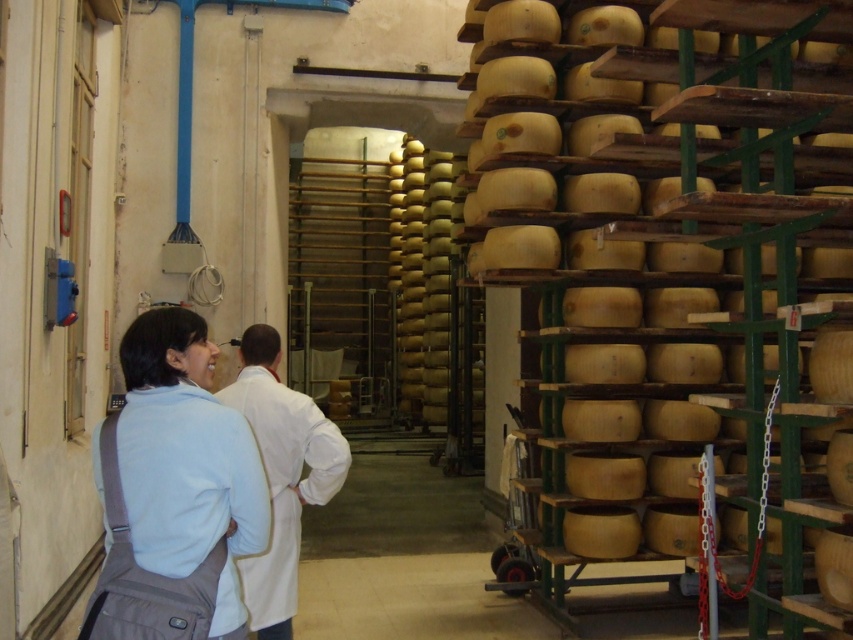
Question: Which point is farther to the camera?

Choices:
 (A) white lab coat at center
 (B) wooden cheese at center
 (C) light blue fabric at center

Answer: (A)

Question: Which point appears closest to the camera in this image?

Choices:
 (A) (740, 164)
 (B) (325, 460)
 (C) (265, 541)

Answer: (C)

Question: Among these objects, which one is farthest from the camera?

Choices:
 (A) wooden cheese at center
 (B) light blue fabric at center
 (C) white lab coat at center

Answer: (C)

Question: Considering the relative positions of wooden cheese at center and light blue fabric at center in the image provided, where is wooden cheese at center located with respect to light blue fabric at center?

Choices:
 (A) above
 (B) below

Answer: (A)

Question: Does light blue fabric at center appear over white lab coat at center?

Choices:
 (A) yes
 (B) no

Answer: (A)

Question: Does wooden cheese at center appear under light blue fabric at center?

Choices:
 (A) yes
 (B) no

Answer: (B)